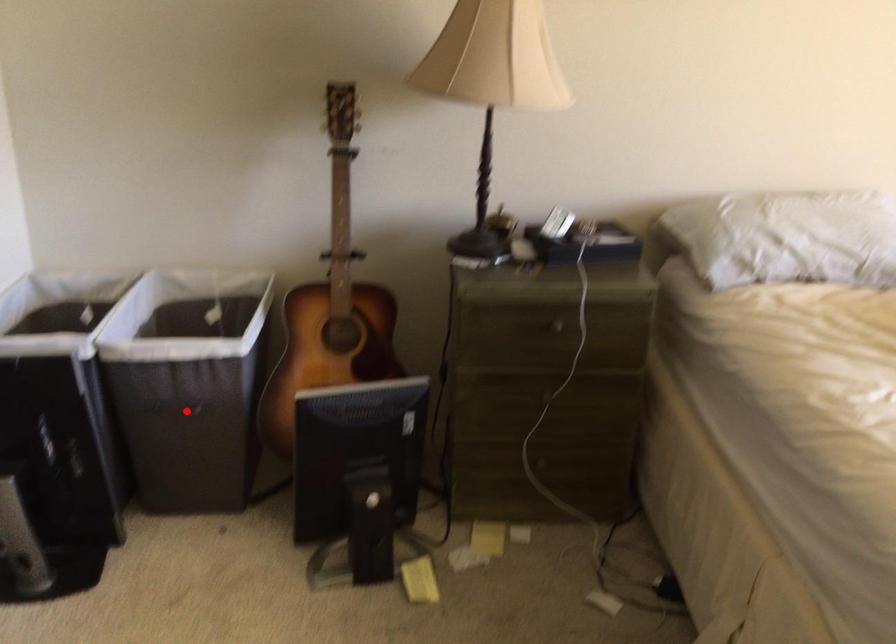
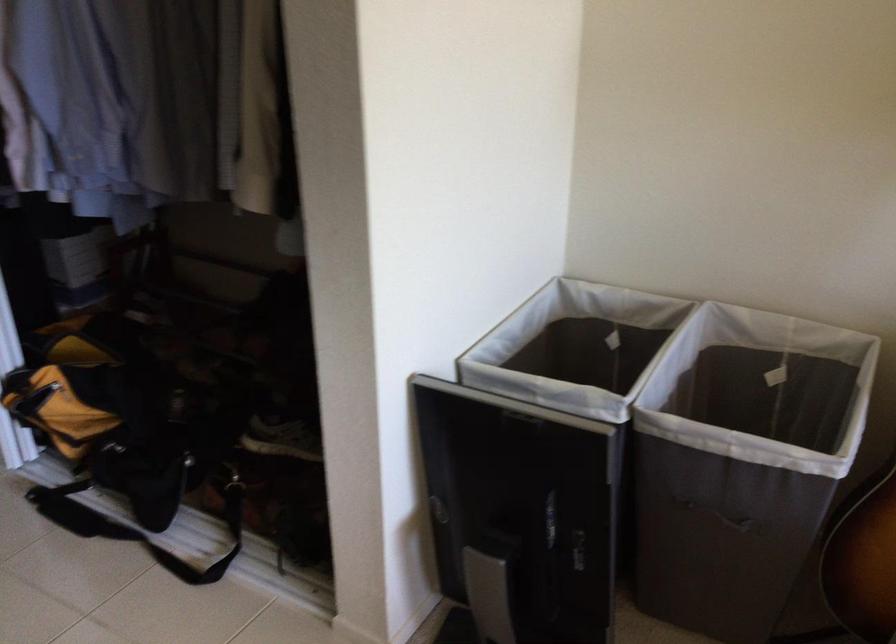
Question: I am providing you with two images of the same scene from different viewpoints. A red point is marked on the first image. At the location where the point appears in image 1, is it still visible in image 2?

Choices:
 (A) Yes
 (B) No

Answer: (A)